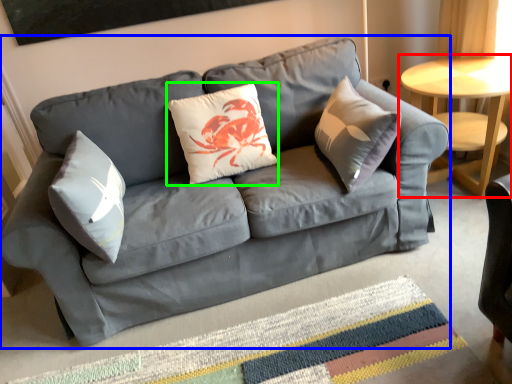
Question: Considering the real-world distances, which object is farthest from table (highlighted by a red box)? studio couch (highlighted by a blue box) or pillow (highlighted by a green box)?

Choices:
 (A) studio couch
 (B) pillow

Answer: (B)